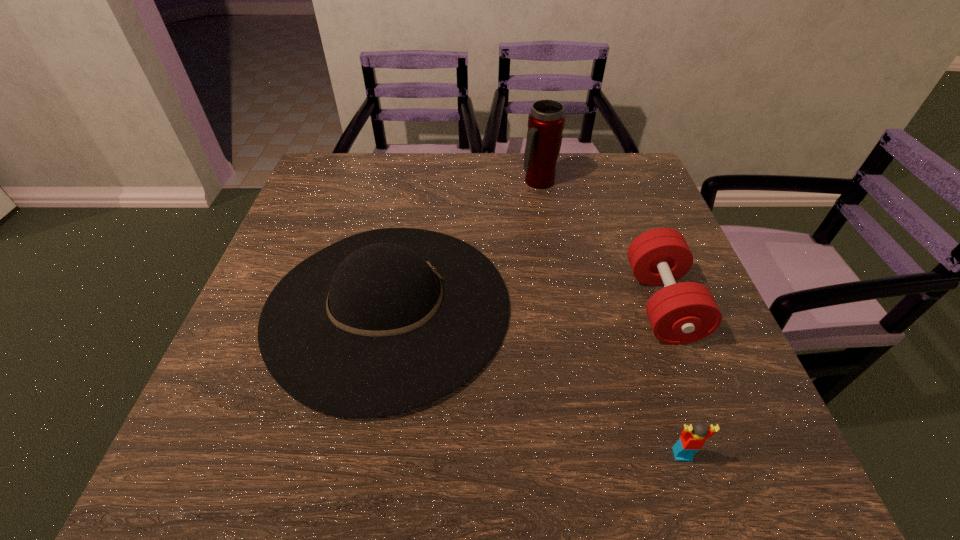
What are the coordinates of `object that is the third closest to the shortest object` in the screenshot? It's located at (546, 120).

Identify which object is the nearest to the nearest object. Please provide its 2D coordinates. Your answer should be formatted as a tuple, i.e. [(x, y)], where the tuple contains the x and y coordinates of a point satisfying the conditions above.

[(680, 313)]

At what (x,y) coordinates should I click in order to perform the action: click on free space that satisfies the following two spatial constraints: 1. on the side with the handle of the third object from right to left; 2. on the front-facing side of the second tallest object. Please return your answer as a coordinate pair (x, y). Looking at the image, I should click on (559, 307).